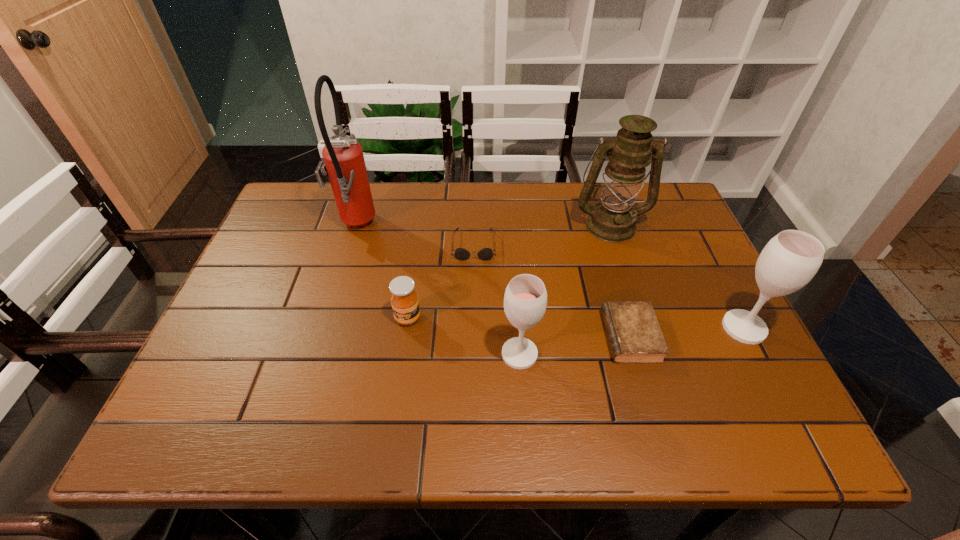
Where is `diary`? Image resolution: width=960 pixels, height=540 pixels. diary is located at coordinates (634, 335).

Locate an element on the screen. The image size is (960, 540). free space located on the left of the shorter wineglass is located at coordinates (398, 354).

Image resolution: width=960 pixels, height=540 pixels. In order to click on blank area located 0.060m on the front of the rightmost object in this screenshot , I will do `click(765, 369)`.

Where is `vacant space located at the nozzle of the fire extinguisher`? vacant space located at the nozzle of the fire extinguisher is located at coordinates (468, 227).

Identify the location of vacant area situated 0.140m on the front-facing side of the fifth object from right to left. (473, 302).

Where is `free space located on the front of the oil lamp`? The height and width of the screenshot is (540, 960). free space located on the front of the oil lamp is located at coordinates (649, 347).

You are a GUI agent. You are given a task and a screenshot of the screen. Output one action in this format:
    pyautogui.click(x=<x>, y=<y>)
    Task: Click on the free spot located on the front-facing side of the third shortest object
    
    Given the screenshot: What is the action you would take?
    pyautogui.click(x=402, y=359)

At what (x,y) coordinates should I click in order to perform the action: click on free point located 0.310m on the spine side of the diary. Please return your answer as a coordinate pair (x, y). Looking at the image, I should click on (466, 336).

Where is `blank space located on the spine side of the diary`? The height and width of the screenshot is (540, 960). blank space located on the spine side of the diary is located at coordinates (511, 336).

Find the location of a particular element. This screenshot has width=960, height=540. vacant area located on the spine side of the diary is located at coordinates (447, 336).